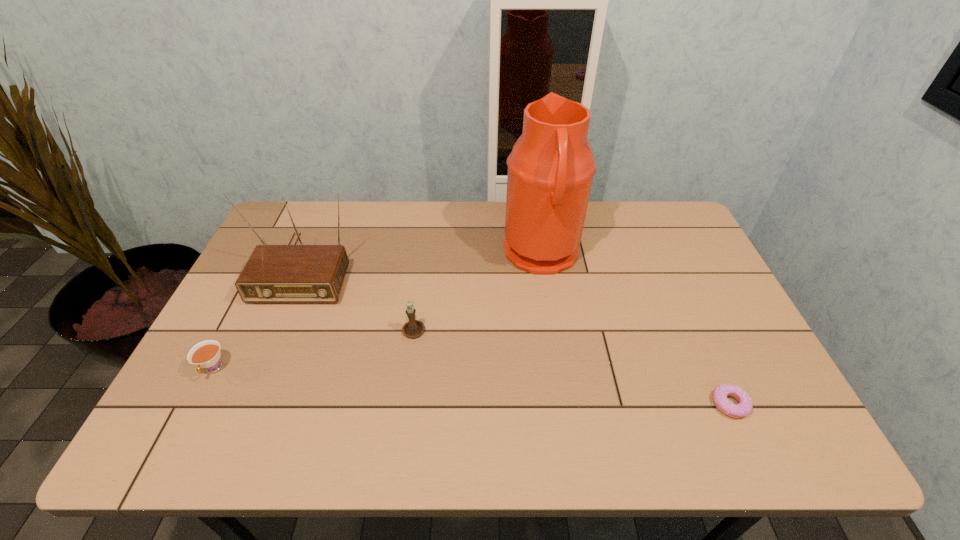
This screenshot has width=960, height=540. I want to click on the tallest object, so click(550, 170).

Where is `the fourth object from left to right`? The width and height of the screenshot is (960, 540). the fourth object from left to right is located at coordinates (550, 170).

I want to click on the fourth shortest object, so click(288, 273).

Where is `the third shortest object`? The width and height of the screenshot is (960, 540). the third shortest object is located at coordinates (413, 328).

Locate an element on the screen. The height and width of the screenshot is (540, 960). the third object from left to right is located at coordinates (413, 328).

Locate an element on the screen. the second shortest object is located at coordinates (206, 354).

Locate an element on the screen. The image size is (960, 540). the fourth farthest object is located at coordinates (206, 354).

Locate an element on the screen. The image size is (960, 540). the shortest object is located at coordinates (744, 407).

Where is `the nearest object`? the nearest object is located at coordinates (744, 407).

Image resolution: width=960 pixels, height=540 pixels. Find the location of `free space located from the spout of the water jug`. free space located from the spout of the water jug is located at coordinates (387, 254).